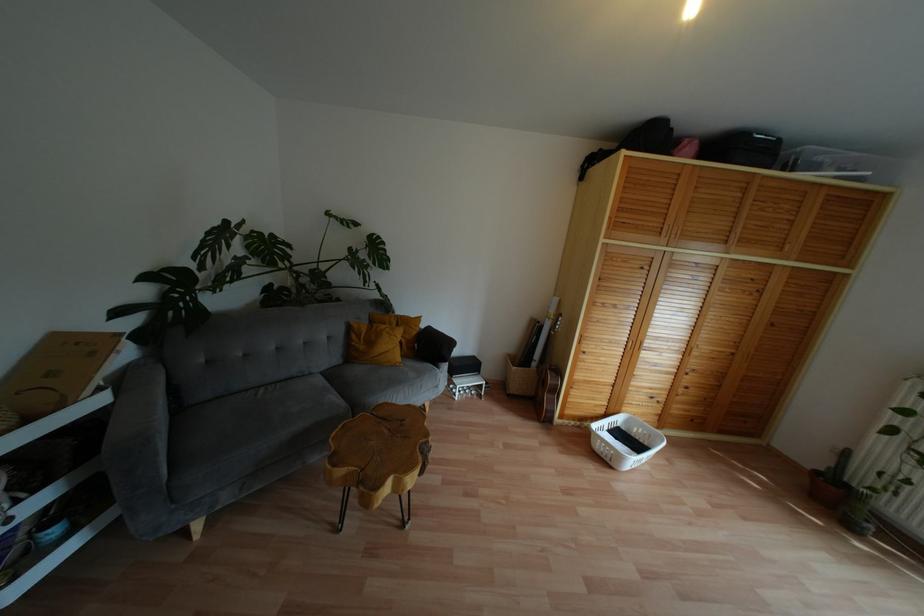
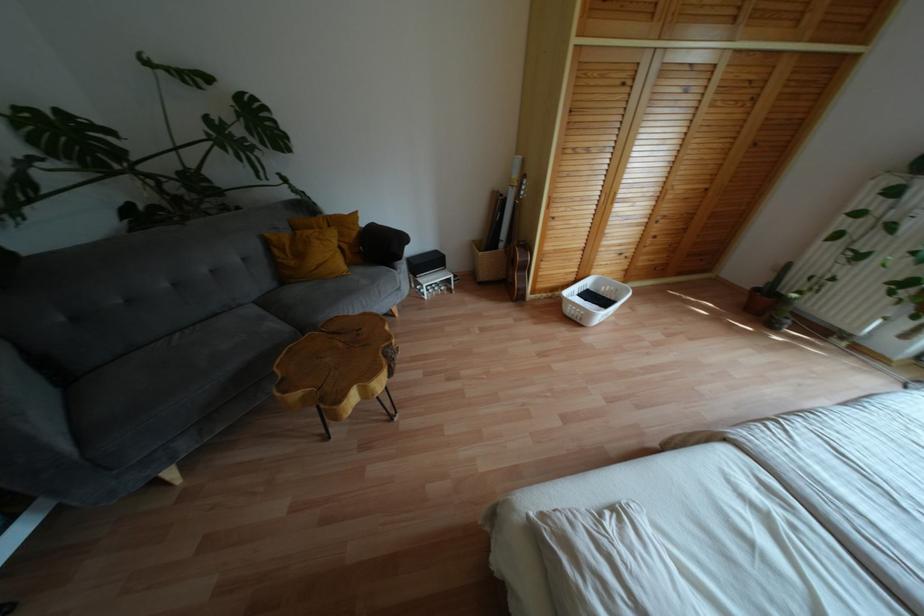
In the second image, find the point that corresponds to (x=431, y=346) in the first image.

(380, 246)